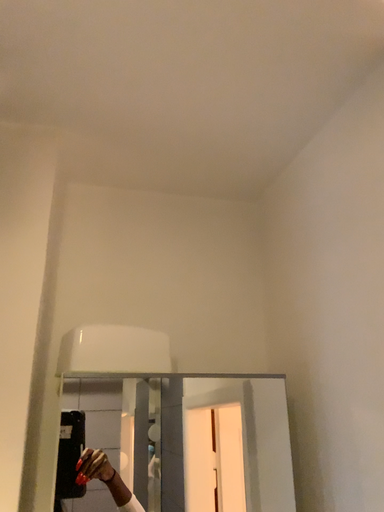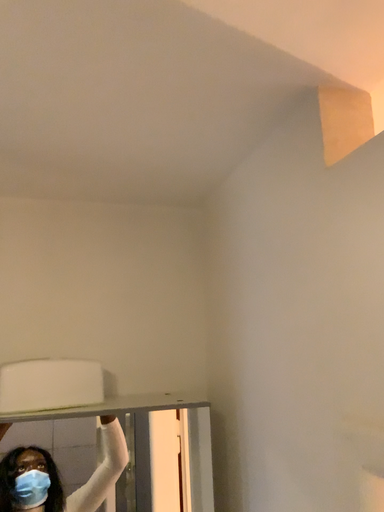
Question: Which way did the camera rotate in the video?

Choices:
 (A) rotated upward
 (B) rotated downward

Answer: (B)